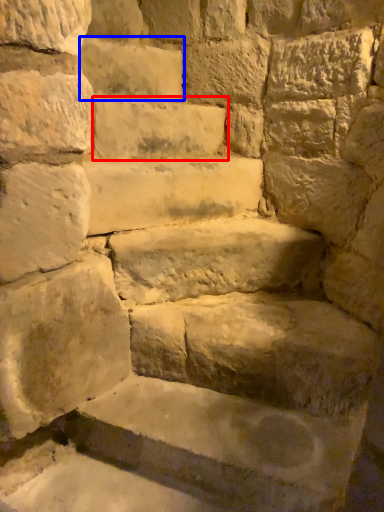
Question: Which object appears closest to the camera in this image, brick (highlighted by a red box) or brick (highlighted by a blue box)?

Choices:
 (A) brick
 (B) brick

Answer: (A)